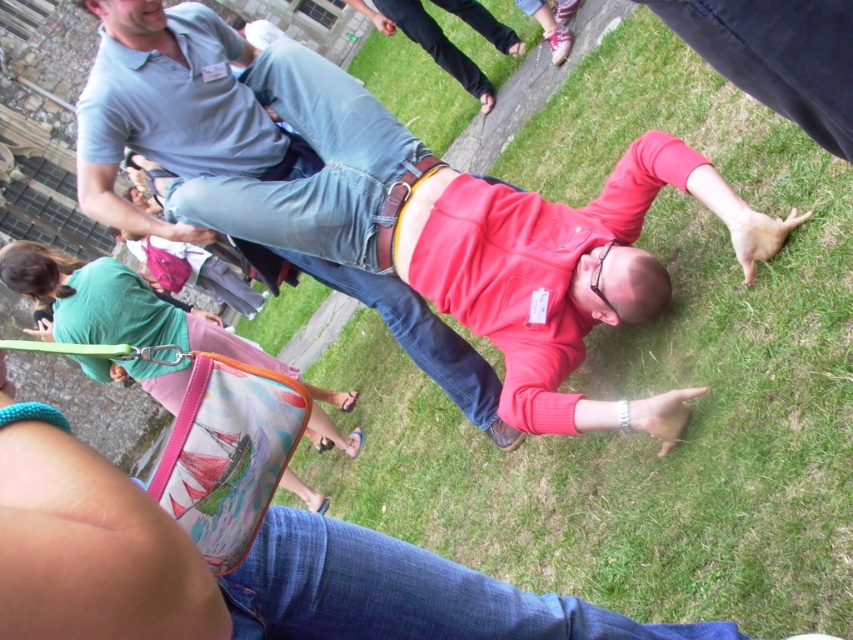
Between point (9, 433) and point (119, 285), which one is positioned behind?

Positioned behind is point (119, 285).

From the picture: Who is taller, matte red sweater at center or matte green shirt at lower left?

matte green shirt at lower left is taller.

Identify the location of matte red sweater at center. The image size is (853, 640). (238, 568).